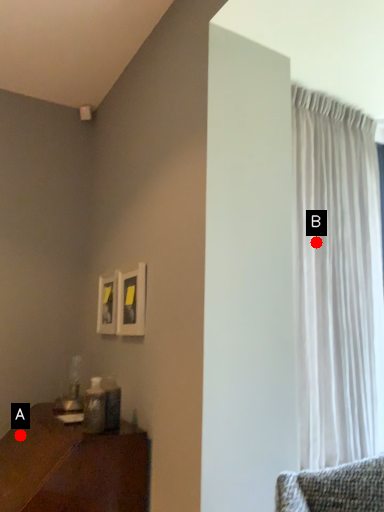
Question: Two points are circled on the image, labeled by A and B beside each circle. Which point appears farthest from the camera in this image?

Choices:
 (A) A is further
 (B) B is further

Answer: (B)